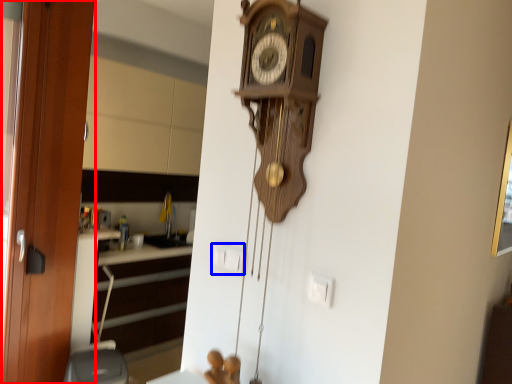
Question: Which point is closer to the camera, door (highlighted by a red box) or electric outlet (highlighted by a blue box)?

Choices:
 (A) door
 (B) electric outlet

Answer: (B)